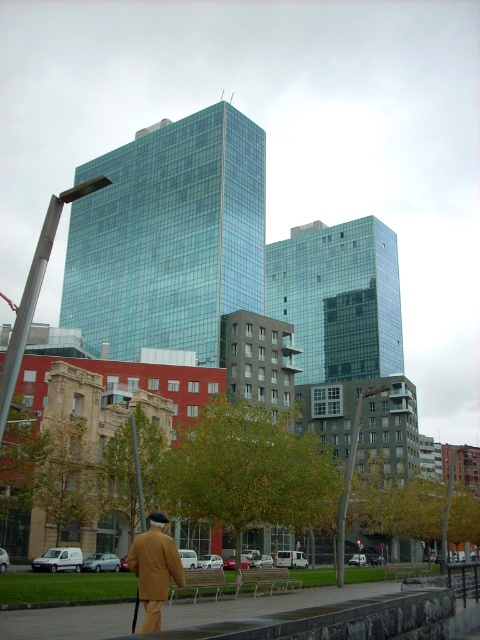
Does gray concrete bench at lower center appear under brown woolen coat at lower left?

Indeed, gray concrete bench at lower center is positioned under brown woolen coat at lower left.

This screenshot has height=640, width=480. What do you see at coordinates (266, 604) in the screenshot?
I see `gray concrete bench at lower center` at bounding box center [266, 604].

Where is `gray concrete bench at lower center`? The height and width of the screenshot is (640, 480). gray concrete bench at lower center is located at coordinates [x=266, y=604].